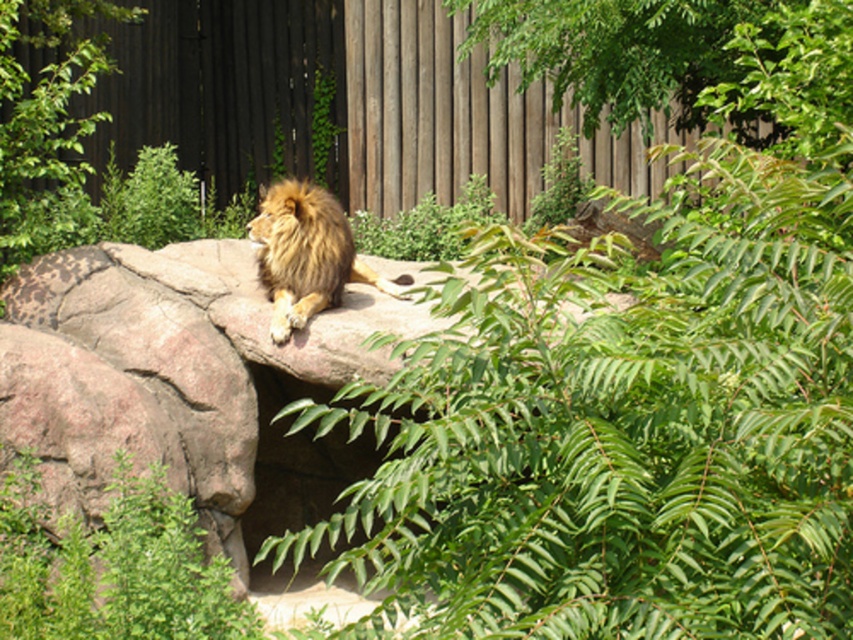
I want to click on brown rough rock at center, so click(x=167, y=365).

Which is more to the left, brown rough rock at center or golden fur lion at center?

From the viewer's perspective, brown rough rock at center appears more on the left side.

Where is `brown rough rock at center`? The height and width of the screenshot is (640, 853). brown rough rock at center is located at coordinates (167, 365).